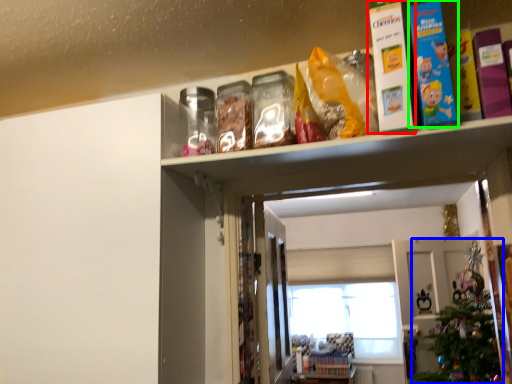
Question: Which is nearer to the book (highlighted by a red box)? christmas tree (highlighted by a blue box) or book (highlighted by a green box).

Choices:
 (A) christmas tree
 (B) book

Answer: (B)